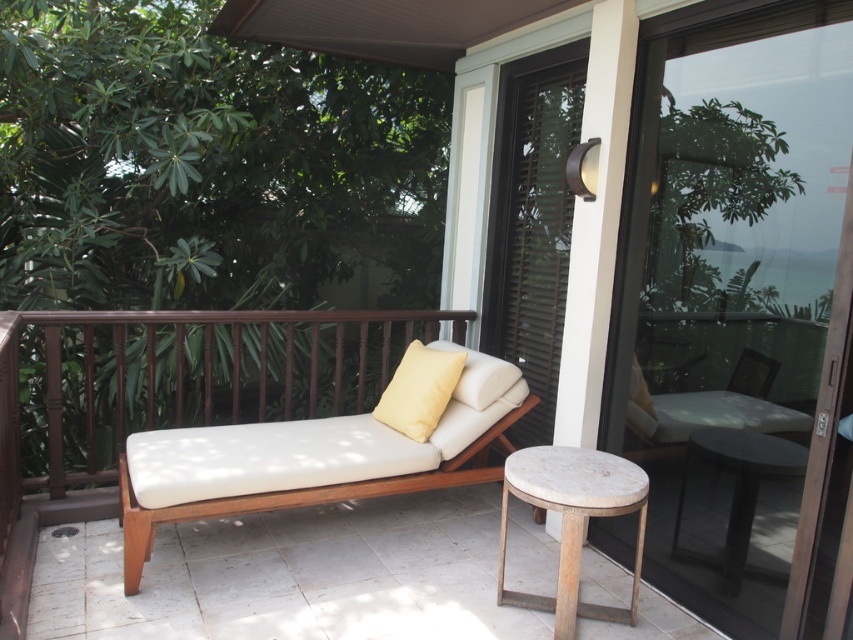
Question: Which point is closer to the camera taking this photo?

Choices:
 (A) (138, 512)
 (B) (579, 506)
 (C) (305, 316)
 (D) (751, 224)

Answer: (B)

Question: Does brown wood rail at center have a lesser width compared to yellow fabric pillow at center?

Choices:
 (A) no
 (B) yes

Answer: (A)

Question: Is transparent glass screen door at right bigger than yellow matte pillow at center?

Choices:
 (A) no
 (B) yes

Answer: (B)

Question: Which point appears farthest from the camera in this image?

Choices:
 (A) (625, 390)
 (B) (18, 324)

Answer: (A)

Question: Considering the relative positions of teak wood bench at center and dark wood stool at lower right in the image provided, where is teak wood bench at center located with respect to dark wood stool at lower right?

Choices:
 (A) right
 (B) left

Answer: (B)

Question: Considering the real-world distances, which object is closest to the dark wood stool at lower right?

Choices:
 (A) yellow matte pillow at center
 (B) yellow fabric pillow at center
 (C) transparent glass screen door at right
 (D) brown wood rail at center

Answer: (C)